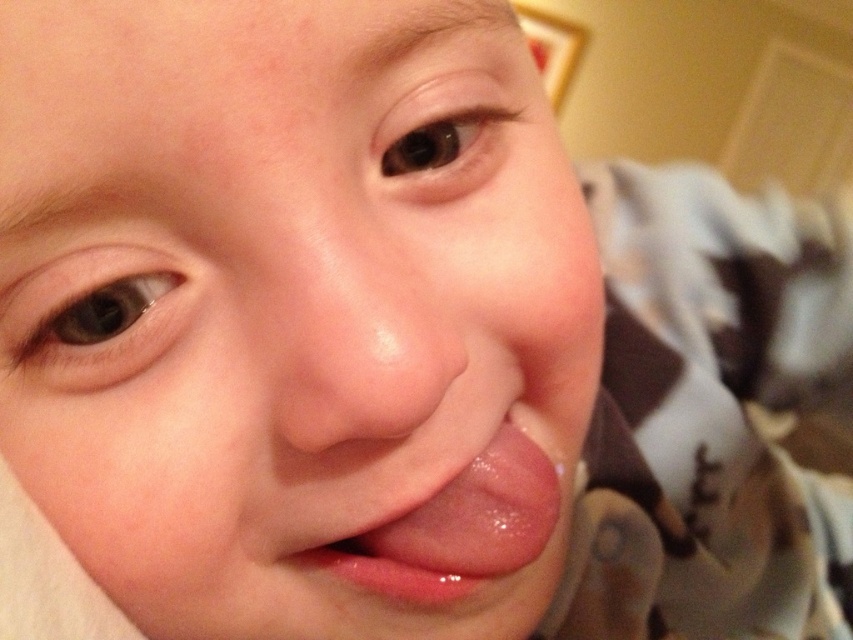
Question: Which object is closer to the camera taking this photo?

Choices:
 (A) smooth skin face at center
 (B) glossy pink tongue at center

Answer: (A)

Question: Can you confirm if smooth flesh nose at center is positioned above glossy pink tongue at center?

Choices:
 (A) no
 (B) yes

Answer: (B)

Question: Is smooth flesh nose at center smaller than glossy pink tongue at center?

Choices:
 (A) no
 (B) yes

Answer: (B)

Question: Among these points, which one is farthest from the camera?

Choices:
 (A) (546, 522)
 (B) (537, 550)
 (C) (347, 428)

Answer: (A)

Question: Which of the following is the closest to the observer?

Choices:
 (A) (410, 596)
 (B) (277, 356)
 (C) (489, 307)

Answer: (B)

Question: Can you confirm if smooth skin face at center is smaller than glossy pink tongue at center?

Choices:
 (A) no
 (B) yes

Answer: (A)